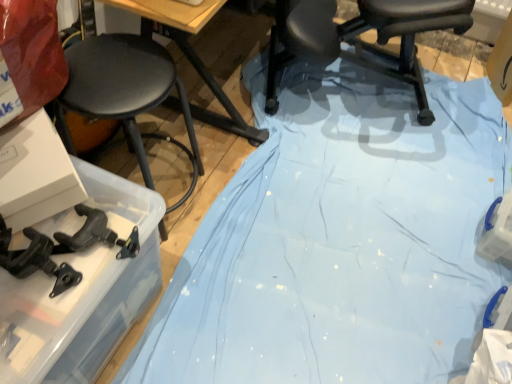
Question: Visually, is black matte stool at left positioned to the left or to the right of black plastic chair at center?

Choices:
 (A) right
 (B) left

Answer: (B)

Question: Would you say black matte stool at left is inside or outside black plastic chair at center?

Choices:
 (A) inside
 (B) outside

Answer: (B)

Question: Which object is the farthest from the wooden at upper center?

Choices:
 (A) black plastic chair at center
 (B) black matte stool at left

Answer: (A)

Question: Considering the real-world distances, which object is closest to the black matte stool at left?

Choices:
 (A) wooden at upper center
 (B) black plastic chair at center

Answer: (A)